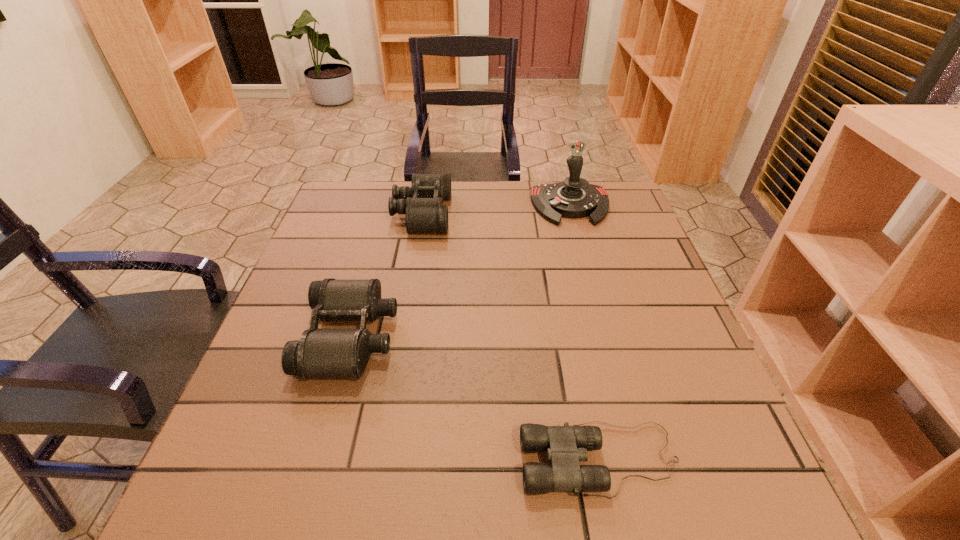
This screenshot has width=960, height=540. I want to click on free space located 0.330m at the eyepiece of the nearest binoculars, so click(x=323, y=460).

Locate an element on the screen. This screenshot has height=540, width=960. joystick located in the far edge section of the desktop is located at coordinates (574, 198).

Find the location of a particular element. Image resolution: width=960 pixels, height=540 pixels. binoculars at the far edge is located at coordinates (421, 203).

At what (x,y) coordinates should I click in order to perform the action: click on object that is at the near edge. Please return your answer as a coordinate pair (x, y). Looking at the image, I should click on (566, 446).

Image resolution: width=960 pixels, height=540 pixels. In order to click on object present at the left edge in this screenshot , I will do `click(320, 353)`.

I want to click on joystick at the right edge, so click(574, 198).

Identify the location of binoculars at the right edge. (566, 446).

Where is `object located at the far right corner`? Image resolution: width=960 pixels, height=540 pixels. object located at the far right corner is located at coordinates (574, 198).

You are a GUI agent. You are given a task and a screenshot of the screen. Output one action in this format:
    pyautogui.click(x=<x>, y=<y>)
    Task: Click on the object present at the near right corner
    
    Given the screenshot: What is the action you would take?
    pyautogui.click(x=566, y=446)

Locate an element on the screen. vacant region at the far edge is located at coordinates (492, 202).